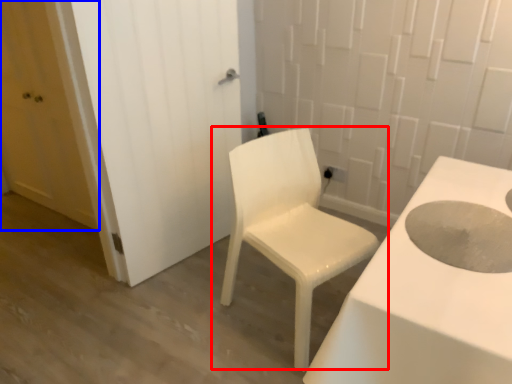
Question: Which object appears closest to the camera in this image, chair (highlighted by a red box) or door (highlighted by a blue box)?

Choices:
 (A) chair
 (B) door

Answer: (A)